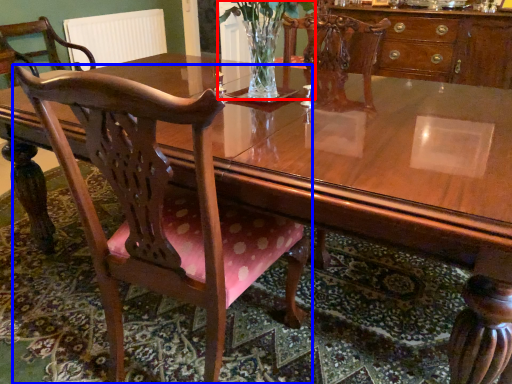
Question: Among these objects, which one is farthest to the camera, floral arrangement (highlighted by a red box) or chair (highlighted by a blue box)?

Choices:
 (A) floral arrangement
 (B) chair

Answer: (A)